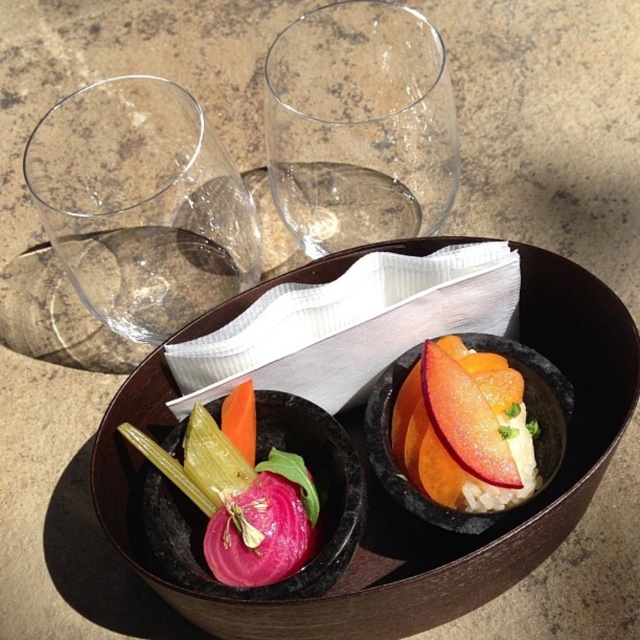
From the picture: You are a guest at a picnic and see the transparent glass at upper center and the sliced apple at center. Which object is taller?

The transparent glass at upper center is taller than the sliced apple at center.

What is located at the coordinate point (358, 125) in the image?

The transparent glass at upper center is located at the coordinate point (358, 125).